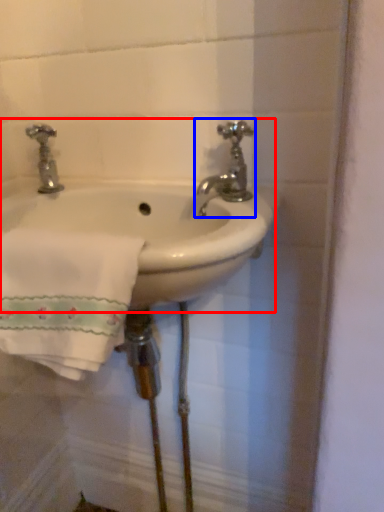
Question: Which object is closer to the camera taking this photo, sink (highlighted by a red box) or tap (highlighted by a blue box)?

Choices:
 (A) sink
 (B) tap

Answer: (A)